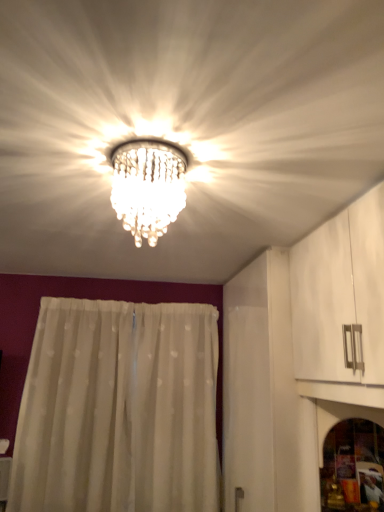
Question: Does transparent glass screen door at lower right have a greater height compared to clear crystal chandelier at center?

Choices:
 (A) no
 (B) yes

Answer: (B)

Question: Is transparent glass screen door at lower right positioned with its back to clear crystal chandelier at center?

Choices:
 (A) no
 (B) yes

Answer: (A)

Question: Does transparent glass screen door at lower right turn towards clear crystal chandelier at center?

Choices:
 (A) yes
 (B) no

Answer: (B)

Question: Is transparent glass screen door at lower right closer to the viewer compared to clear crystal chandelier at center?

Choices:
 (A) no
 (B) yes

Answer: (A)

Question: From a real-world perspective, is transparent glass screen door at lower right on top of clear crystal chandelier at center?

Choices:
 (A) no
 (B) yes

Answer: (A)

Question: From a real-world perspective, is transparent glass screen door at lower right located beneath clear crystal chandelier at center?

Choices:
 (A) yes
 (B) no

Answer: (A)

Question: Is transparent glass screen door at lower right located outside white sheer curtain at center?

Choices:
 (A) yes
 (B) no

Answer: (A)

Question: From the image's perspective, is transparent glass screen door at lower right on top of white sheer curtain at center?

Choices:
 (A) no
 (B) yes

Answer: (B)

Question: Is transparent glass screen door at lower right positioned behind white sheer curtain at center?

Choices:
 (A) no
 (B) yes

Answer: (A)

Question: Are transparent glass screen door at lower right and white sheer curtain at center beside each other?

Choices:
 (A) yes
 (B) no

Answer: (B)

Question: Is transparent glass screen door at lower right wider than white sheer curtain at center?

Choices:
 (A) no
 (B) yes

Answer: (B)

Question: From a real-world perspective, is transparent glass screen door at lower right under white sheer curtain at center?

Choices:
 (A) yes
 (B) no

Answer: (A)

Question: Is clear crystal chandelier at center shorter than white sheer curtain at center?

Choices:
 (A) no
 (B) yes

Answer: (B)